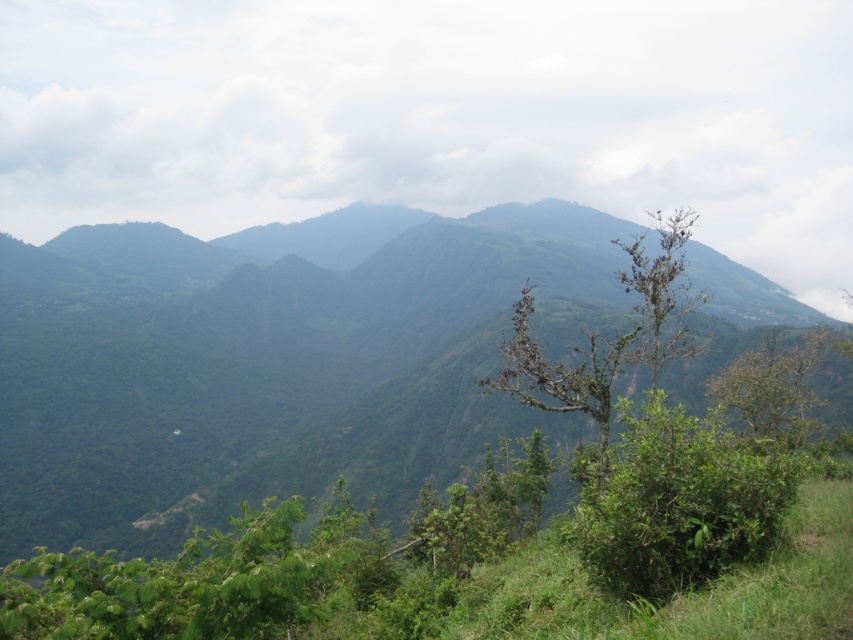
Between point (175, 307) and point (750, 397), which one is positioned in front?

Point (750, 397) is in front.

Which of these two, green leafy mountain at center or green leafy tree at right, stands shorter?

Standing shorter between the two is green leafy tree at right.

Where is `green leafy mountain at center`? green leafy mountain at center is located at coordinates (283, 376).